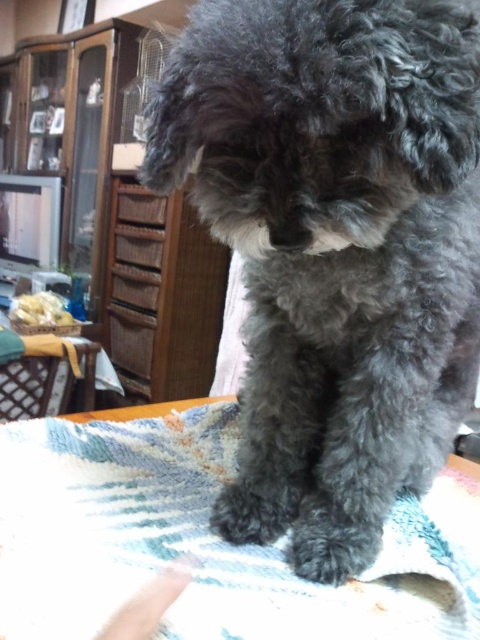
Question: Among these points, which one is farthest from the camera?

Choices:
 (A) (177, 328)
 (B) (471, 284)
 (C) (143, 547)

Answer: (A)

Question: Which point is closer to the camera taking this photo?

Choices:
 (A) (463, 621)
 (B) (285, 232)

Answer: (B)

Question: Does dark gray fur at center appear under blue textured blanket at lower center?

Choices:
 (A) yes
 (B) no

Answer: (B)

Question: From the image, what is the correct spatial relationship of dark gray fur at center in relation to wooden dresser at upper left?

Choices:
 (A) left
 (B) right

Answer: (B)

Question: Is the position of dark gray fur at center more distant than that of wooden dresser at upper left?

Choices:
 (A) no
 (B) yes

Answer: (A)

Question: Which object appears closest to the camera in this image?

Choices:
 (A) blue textured blanket at lower center
 (B) wooden dresser at upper left

Answer: (A)